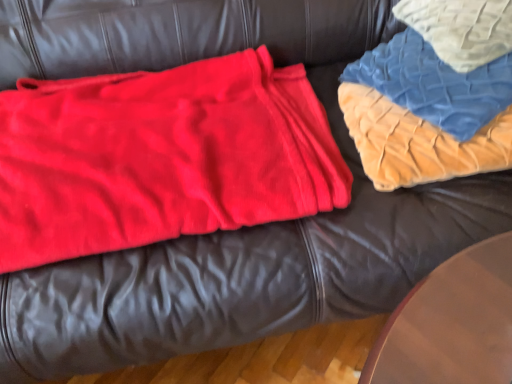
The width and height of the screenshot is (512, 384). What are the coordinates of `velvet quilt at upper right` in the screenshot? It's located at [x=434, y=84].

Measure the distance between matte red blanket at left and camera.

matte red blanket at left is 66.57 centimeters away from camera.

Where is `velvet quilt at upper right`? This screenshot has width=512, height=384. velvet quilt at upper right is located at coordinates (434, 84).

Considering the relative sizes of blue quilted fabric at upper right and matte red blanket at left in the image provided, is blue quilted fabric at upper right thinner than matte red blanket at left?

Yes, blue quilted fabric at upper right is thinner than matte red blanket at left.

From the image's perspective, between blue quilted fabric at upper right and matte red blanket at left, which one is located above?

From the image's view, blue quilted fabric at upper right is above.

Is blue quilted fabric at upper right positioned far away from matte red blanket at left?

No, blue quilted fabric at upper right is in close proximity to matte red blanket at left.

Can you confirm if blue quilted fabric at upper right is taller than matte red blanket at left?

Yes.

From the image's perspective, is velvet quilt at upper right positioned above or below blue quilted fabric at upper right?

velvet quilt at upper right is below blue quilted fabric at upper right.

From a real-world perspective, is velvet quilt at upper right over blue quilted fabric at upper right?

Actually, velvet quilt at upper right is physically below blue quilted fabric at upper right in the real world.

Which is further, [440,63] or [413,19]?

Point [413,19]

Measure the distance from velvet quilt at upper right to blue quilted fabric at upper right.

velvet quilt at upper right is 6.54 centimeters from blue quilted fabric at upper right.

Is matte red blanket at left inside or outside of velvet quilt at upper right?

matte red blanket at left is located beyond the bounds of velvet quilt at upper right.

Is point (284, 94) positioned behind point (485, 86)?

Yes, point (284, 94) is behind point (485, 86).

Could you tell me if matte red blanket at left is facing velvet quilt at upper right?

No, matte red blanket at left is not oriented towards velvet quilt at upper right.

Based on the photo, between matte red blanket at left and velvet quilt at upper right, which one has smaller width?

velvet quilt at upper right is thinner.

How distant is matte red blanket at left from blue quilted fabric at upper right?

matte red blanket at left and blue quilted fabric at upper right are 20.63 inches apart.

From the image's perspective, is matte red blanket at left located above blue quilted fabric at upper right?

No, from the image's perspective, matte red blanket at left is not above blue quilted fabric at upper right.

Is matte red blanket at left next to blue quilted fabric at upper right and touching it?

matte red blanket at left and blue quilted fabric at upper right are not in contact.

Can you confirm if matte red blanket at left is smaller than blue quilted fabric at upper right?

Actually, matte red blanket at left might be larger than blue quilted fabric at upper right.

Is velvet quilt at upper right not close to matte red blanket at left?

No.

Looking at this image, is velvet quilt at upper right wider or thinner than matte red blanket at left?

Considering their sizes, velvet quilt at upper right looks slimmer than matte red blanket at left.

Does velvet quilt at upper right turn towards matte red blanket at left?

No, velvet quilt at upper right is not turned towards matte red blanket at left.

How distant is velvet quilt at upper right from matte red blanket at left?

velvet quilt at upper right is 15.00 inches away from matte red blanket at left.

From a real-world perspective, which is physically below, blue quilted fabric at upper right or velvet quilt at upper right?

In real-world perspective, velvet quilt at upper right is lower.

Can you confirm if blue quilted fabric at upper right is thinner than velvet quilt at upper right?

No.

Who is bigger, blue quilted fabric at upper right or velvet quilt at upper right?

velvet quilt at upper right is bigger.

From their relative heights in the image, would you say blue quilted fabric at upper right is taller or shorter than velvet quilt at upper right?

Clearly, blue quilted fabric at upper right is shorter compared to velvet quilt at upper right.

Where is `bean bag chair that is below the blue quilted fabric at upper right (from the image's perspective)`? bean bag chair that is below the blue quilted fabric at upper right (from the image's perspective) is located at coordinates (161, 157).

In the image, there is a blue quilted fabric at upper right. At what (x,y) coordinates should I click in order to perform the action: click on blanket below it (from a real-world perspective). Please return your answer as a coordinate pair (x, y). This screenshot has height=384, width=512. Looking at the image, I should click on (434, 84).

Estimate the real-world distances between objects in this image. Which object is further from velvet quilt at upper right, blue quilted fabric at upper right or matte red blanket at left?

Among the two, matte red blanket at left is located further to velvet quilt at upper right.

Considering their positions, is matte red blanket at left positioned closer to velvet quilt at upper right than blue quilted fabric at upper right?

The object closer to velvet quilt at upper right is blue quilted fabric at upper right.

Looking at the image, which one is located closer to blue quilted fabric at upper right, velvet quilt at upper right or matte red blanket at left?

velvet quilt at upper right.

Estimate the real-world distances between objects in this image. Which object is closer to blue quilted fabric at upper right, matte red blanket at left or velvet quilt at upper right?

Based on the image, velvet quilt at upper right appears to be nearer to blue quilted fabric at upper right.

From the image, which object appears to be nearer to matte red blanket at left, blue quilted fabric at upper right or velvet quilt at upper right?

velvet quilt at upper right is closer to matte red blanket at left.

From the image, which object appears to be farther from matte red blanket at left, velvet quilt at upper right or blue quilted fabric at upper right?

blue quilted fabric at upper right lies further to matte red blanket at left than the other object.

The image size is (512, 384). I want to click on blanket located between matte red blanket at left and blue quilted fabric at upper right in the left-right direction, so click(434, 84).